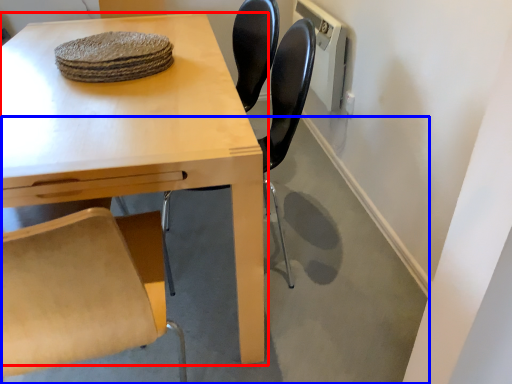
Question: Which point is further to the camera, table (highlighted by a red box) or concrete (highlighted by a blue box)?

Choices:
 (A) table
 (B) concrete

Answer: (B)